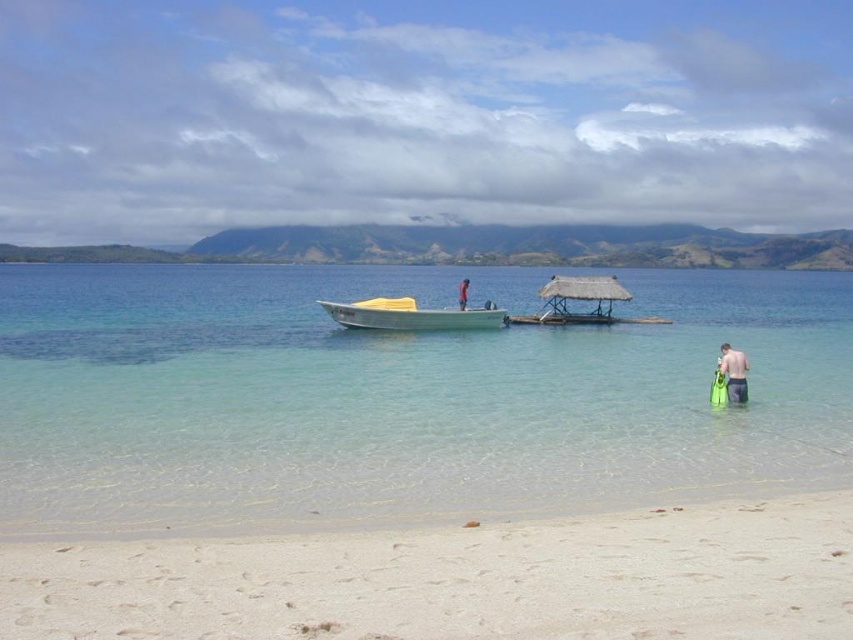
You are standing on the shore looking at the scene. Which object is positioned to the right of the other between the white sandy beach at lower center and the skinny man at center?

The white sandy beach at lower center is positioned to the right of the skinny man at center.

You are standing on the beach and want to reach the white glossy boat at center. If your walking speed is 1.5 meters per second, how many seconds will it take you to reach the boat?

The distance of white glossy boat at center from viewer is 34.03 meters. At a walking speed of 1.5 meters per second, it would take approximately 22.69 seconds to reach the boat.